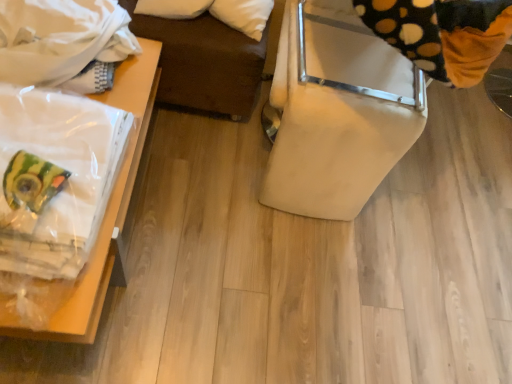
Question: Does clear plastic bag at left, placed as the 2th furniture when sorted from right to left, contain white cotton blanket at upper left?

Choices:
 (A) yes
 (B) no

Answer: (B)

Question: From the image's perspective, is clear plastic bag at left, placed as the 2th furniture when sorted from right to left, on top of white cotton blanket at upper left?

Choices:
 (A) no
 (B) yes

Answer: (A)

Question: Does clear plastic bag at left, arranged as the first furniture when viewed from the left, appear on the left side of white cotton blanket at upper left?

Choices:
 (A) no
 (B) yes

Answer: (A)

Question: Is clear plastic bag at left, arranged as the first furniture when viewed from the left, oriented away from white cotton blanket at upper left?

Choices:
 (A) no
 (B) yes

Answer: (A)

Question: Is clear plastic bag at left, arranged as the first furniture when viewed from the left, taller than white cotton blanket at upper left?

Choices:
 (A) no
 (B) yes

Answer: (B)

Question: Is clear plastic bag at left, arranged as the first furniture when viewed from the left, further to camera compared to white cotton blanket at upper left?

Choices:
 (A) yes
 (B) no

Answer: (B)

Question: Does beige fabric chair at right, which is counted as the second furniture, starting from the left, have a smaller size compared to black dotted fabric at upper right?

Choices:
 (A) yes
 (B) no

Answer: (B)

Question: Is beige fabric chair at right, which is counted as the second furniture, starting from the left, to the left of black dotted fabric at upper right from the viewer's perspective?

Choices:
 (A) no
 (B) yes

Answer: (B)

Question: From a real-world perspective, is beige fabric chair at right, positioned as the 1th furniture in right-to-left order, positioned over black dotted fabric at upper right based on gravity?

Choices:
 (A) yes
 (B) no

Answer: (B)

Question: From the image's perspective, does beige fabric chair at right, which is counted as the second furniture, starting from the left, appear higher than black dotted fabric at upper right?

Choices:
 (A) no
 (B) yes

Answer: (B)

Question: Does beige fabric chair at right, positioned as the 1th furniture in right-to-left order, have a lesser width compared to black dotted fabric at upper right?

Choices:
 (A) no
 (B) yes

Answer: (A)

Question: Can you see beige fabric chair at right, which is counted as the second furniture, starting from the left, touching black dotted fabric at upper right?

Choices:
 (A) no
 (B) yes

Answer: (A)

Question: From a real-world perspective, does white cotton blanket at upper left stand above clear plastic bag at left, arranged as the first furniture when viewed from the left?

Choices:
 (A) yes
 (B) no

Answer: (A)